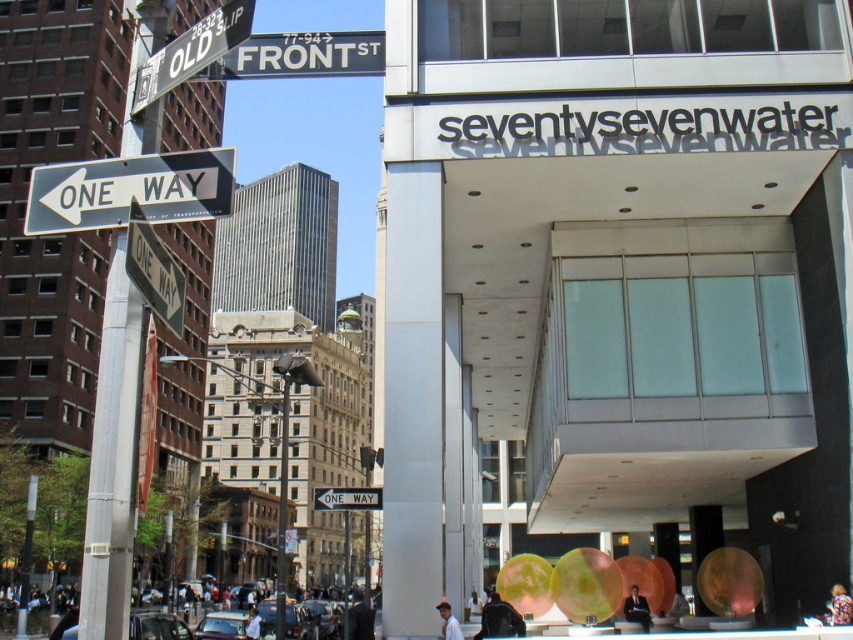
Question: Is green translucent bubble at center smaller than white plastic street sign at lower center?

Choices:
 (A) no
 (B) yes

Answer: (B)

Question: Estimate the real-world distances between objects in this image. Which object is closer to the black plastic one way sign at left?

Choices:
 (A) metallic pole at center
 (B) green translucent bubble at center
 (C) white plastic street sign at upper center

Answer: (C)

Question: Which object is positioned closest to the metallic pole at center?

Choices:
 (A) black plastic one way sign at left
 (B) white plastic street sign at lower center
 (C) green translucent bubble at center
 (D) white plastic street sign at upper center

Answer: (B)

Question: Which of the following is the farthest from the observer?

Choices:
 (A) green translucent bubble at center
 (B) white plastic street sign at upper center
 (C) metallic pole at center

Answer: (A)

Question: Is white plastic street sign at upper center to the right of metallic pole at center from the viewer's perspective?

Choices:
 (A) no
 (B) yes

Answer: (B)

Question: Is white plastic street sign at upper center positioned behind metallic silver street sign at upper left?

Choices:
 (A) no
 (B) yes

Answer: (B)